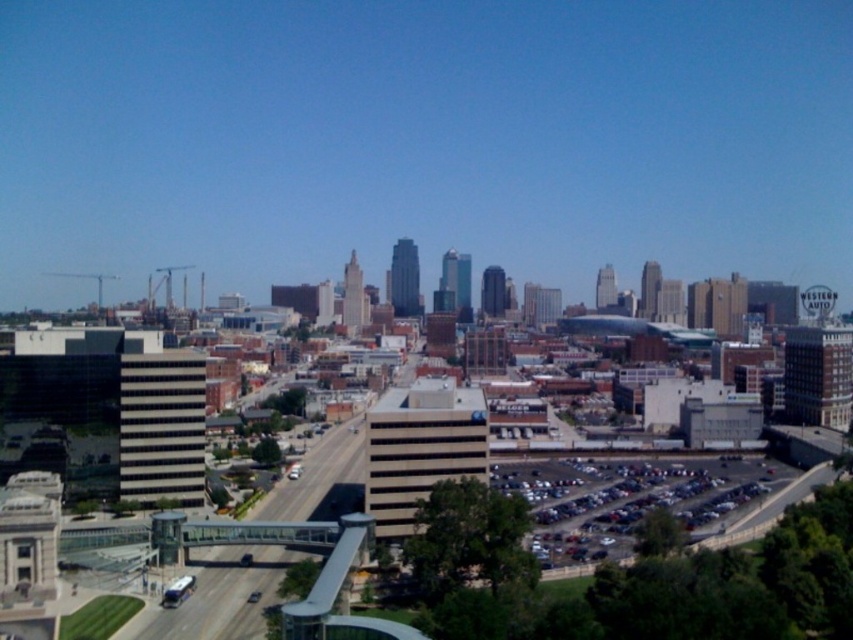
Consider the image. Measure the distance from smooth concrete highway at center to metallic gray cars at lower right.

smooth concrete highway at center and metallic gray cars at lower right are 159.87 feet apart.

Is point (276, 509) closer to viewer compared to point (575, 500)?

Yes, point (276, 509) is in front of point (575, 500).

Who is more forward, (337, 452) or (589, 508)?

Positioned in front is point (589, 508).

Locate an element on the screen. The image size is (853, 640). smooth concrete highway at center is located at coordinates (270, 548).